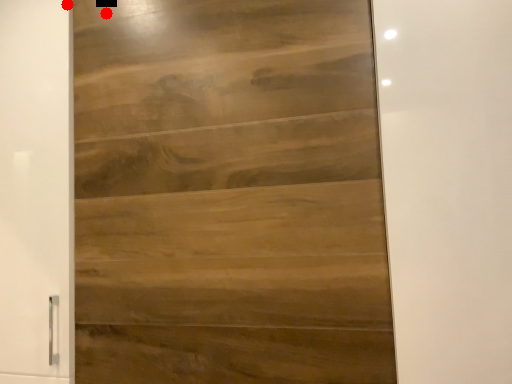
Question: Two points are circled on the image, labeled by A and B beside each circle. Which of the following is the farthest from the observer?

Choices:
 (A) A is further
 (B) B is further

Answer: (A)